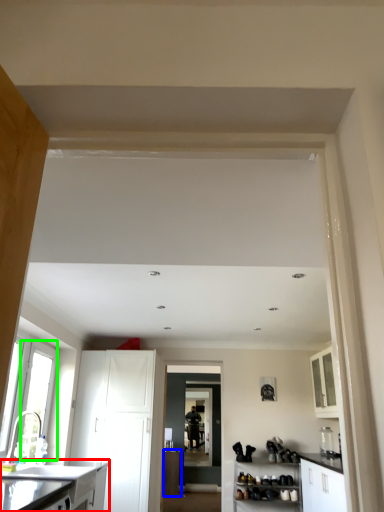
Question: Estimate the real-world distances between objects in this image. Which object is farther from cabinetry (highlighted by a red box), cabinetry (highlighted by a blue box) or window (highlighted by a green box)?

Choices:
 (A) cabinetry
 (B) window

Answer: (A)